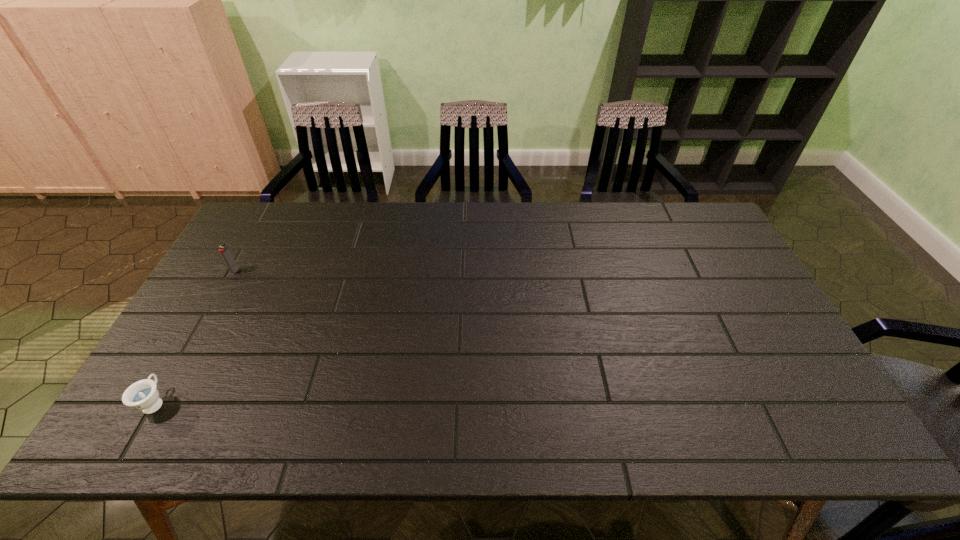
Where is `blank area in the image that satisfies the following two spatial constraints: 1. on the side of the farther object with the handle; 2. on the right side of the nearer object`? The width and height of the screenshot is (960, 540). blank area in the image that satisfies the following two spatial constraints: 1. on the side of the farther object with the handle; 2. on the right side of the nearer object is located at coordinates (230, 271).

This screenshot has width=960, height=540. Identify the location of vacant region that satisfies the following two spatial constraints: 1. on the side of the nearer object with the handle; 2. on the right side of the taller object. (230, 271).

Locate an element on the screen. The height and width of the screenshot is (540, 960). free space in the image that satisfies the following two spatial constraints: 1. on the side of the farther object with the handle; 2. on the right side of the shorter object is located at coordinates (230, 271).

Locate an element on the screen. vacant point that satisfies the following two spatial constraints: 1. on the side of the farther object with the handle; 2. on the left side of the shorter object is located at coordinates (230, 271).

This screenshot has height=540, width=960. What are the coordinates of `free space that satisfies the following two spatial constraints: 1. on the side of the nearer object with the handle; 2. on the right side of the farther object` in the screenshot? It's located at (230, 271).

Image resolution: width=960 pixels, height=540 pixels. Find the location of `free space that satisfies the following two spatial constraints: 1. on the side of the teacup with the handle; 2. on the left side of the taller object`. free space that satisfies the following two spatial constraints: 1. on the side of the teacup with the handle; 2. on the left side of the taller object is located at coordinates (230, 271).

Locate an element on the screen. vacant point that satisfies the following two spatial constraints: 1. on the side of the shorter object with the handle; 2. on the left side of the taller object is located at coordinates (230, 271).